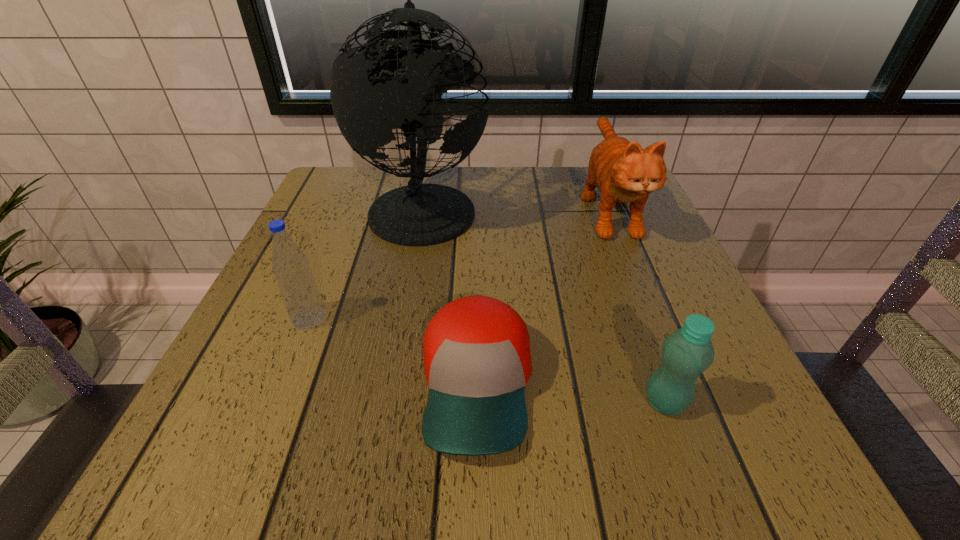
In order to click on water bottle that is at the right edge in this screenshot , I will do `click(685, 354)`.

Locate an element on the screen. This screenshot has height=540, width=960. object at the far left corner is located at coordinates (417, 214).

Where is `object situated at the far right corner`? This screenshot has height=540, width=960. object situated at the far right corner is located at coordinates (623, 172).

In order to click on object at the near right corner in this screenshot , I will do `click(685, 354)`.

Find the location of a particular element. This screenshot has width=960, height=540. vacant space at the far edge of the desktop is located at coordinates (523, 202).

Locate an element on the screen. The height and width of the screenshot is (540, 960). free space at the near edge of the desktop is located at coordinates (586, 474).

Image resolution: width=960 pixels, height=540 pixels. In the image, there is a desktop. In order to click on blank space at the left edge in this screenshot , I will do `click(367, 220)`.

This screenshot has width=960, height=540. What are the coordinates of `vacant space at the right edge of the desktop` in the screenshot? It's located at (661, 230).

This screenshot has width=960, height=540. Identify the location of free space at the near left corner of the desktop. (180, 455).

Identify the location of vacant space at the far right corner of the desktop. [578, 188].